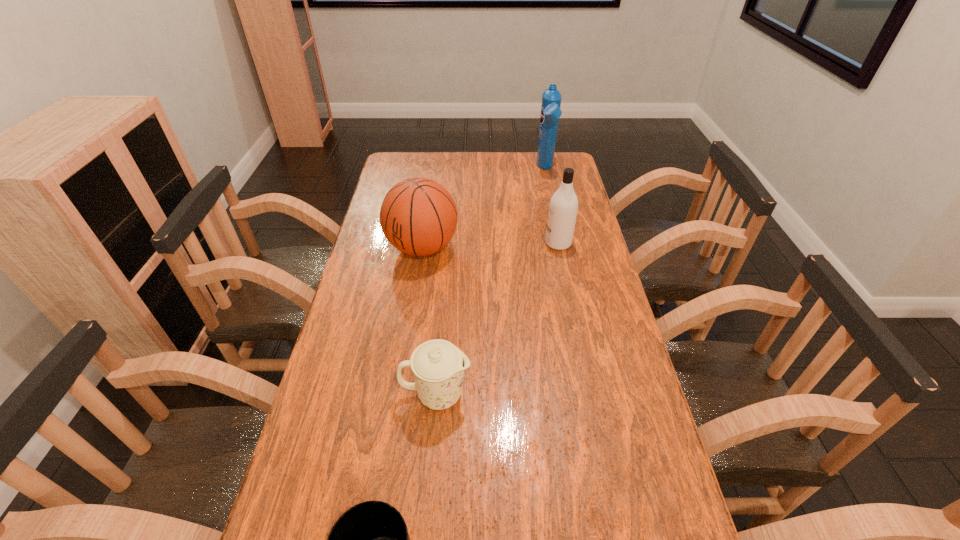
Image resolution: width=960 pixels, height=540 pixels. Identify the location of the taller shampoo. (551, 98).

Where is `the farthest object`? This screenshot has height=540, width=960. the farthest object is located at coordinates (551, 98).

Locate an element on the screen. The width and height of the screenshot is (960, 540). the shorter shampoo is located at coordinates (563, 207).

Locate an element on the screen. This screenshot has height=540, width=960. basketball is located at coordinates (418, 216).

Identify the location of the second nearest object. Image resolution: width=960 pixels, height=540 pixels. (438, 365).

This screenshot has height=540, width=960. I want to click on vacant space located 0.160m on the front of the taller shampoo, so click(553, 202).

At what (x,y) coordinates should I click in order to perform the action: click on vacant region located on the front-facing side of the shorter shampoo. Please return your answer as a coordinate pair (x, y). This screenshot has width=960, height=540. Looking at the image, I should click on (450, 243).

The image size is (960, 540). In order to click on vacant position located 0.370m on the front-facing side of the shorter shampoo in this screenshot , I will do `click(439, 243)`.

The width and height of the screenshot is (960, 540). What are the coordinates of `free space located on the front-facing side of the shorter shampoo` in the screenshot? It's located at (501, 243).

You are a GUI agent. You are given a task and a screenshot of the screen. Output one action in this format:
    pyautogui.click(x=<x>, y=<y>)
    Task: Click on the free region located 0.060m on the back of the basketball
    This screenshot has width=960, height=540.
    Given the screenshot: What is the action you would take?
    pyautogui.click(x=427, y=217)